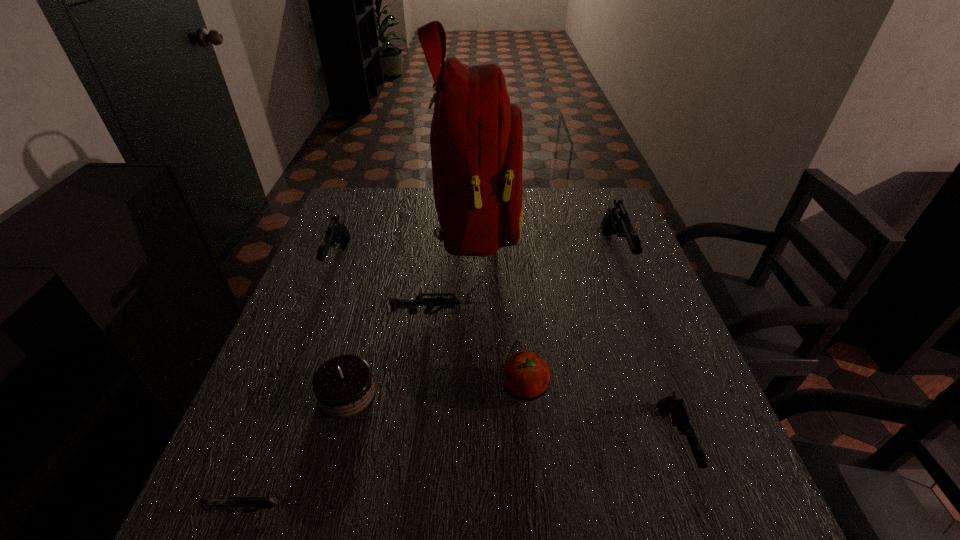
Identify the location of vacant area situated 0.360m aimed along the barrel of the right grey gun. (632, 314).

At what (x,y) coordinates should I click in order to perform the action: click on free space located aimed along the barrel of the smaller grey gun. Please return your answer as a coordinate pair (x, y). The image size is (960, 540). Looking at the image, I should click on pos(509,511).

Find the location of a particular element. Image resolution: width=960 pixels, height=540 pixels. backpack that is at the far edge is located at coordinates (476, 138).

Locate an element on the screen. gun positioned at the far edge is located at coordinates (616, 221).

The image size is (960, 540). What are the coordinates of `chocolate cake that is at the left edge` in the screenshot? It's located at (344, 386).

You are a GUI agent. You are given a task and a screenshot of the screen. Output one action in this format:
    pyautogui.click(x=<x>, y=<y>)
    Task: Click on the object situated at the near left corner
    The height and width of the screenshot is (540, 960).
    Given the screenshot: What is the action you would take?
    pyautogui.click(x=246, y=503)

Identify the location of object positioned at the far right corner. This screenshot has height=540, width=960. (616, 221).

At what (x,y) coordinates should I click in order to perform the action: click on object present at the near right corner. Please return your answer as a coordinate pair (x, y). Image resolution: width=960 pixels, height=540 pixels. Looking at the image, I should click on (680, 417).

Where is `vacant space at the far edge of the desktop`? The width and height of the screenshot is (960, 540). vacant space at the far edge of the desktop is located at coordinates (551, 200).

The height and width of the screenshot is (540, 960). In the image, there is a desktop. Find the location of `vacant space at the near edge`. vacant space at the near edge is located at coordinates pyautogui.click(x=653, y=538).